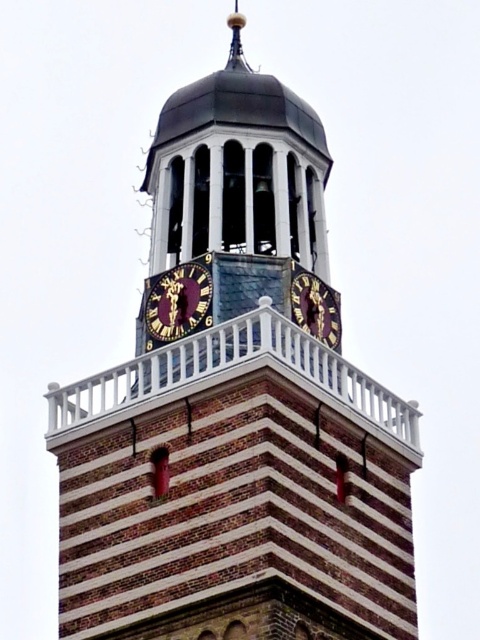
Question: Does gold metallic clock at center appear on the left side of gold metallic clock at upper center?

Choices:
 (A) yes
 (B) no

Answer: (A)

Question: Is the position of gold metallic clock at center less distant than that of gold metallic clock at upper center?

Choices:
 (A) no
 (B) yes

Answer: (B)

Question: Does gold metallic clock at center appear on the left side of gold metallic clock at upper center?

Choices:
 (A) yes
 (B) no

Answer: (A)

Question: Which of the following is the farthest from the observer?

Choices:
 (A) (197, 307)
 (B) (312, 316)

Answer: (B)